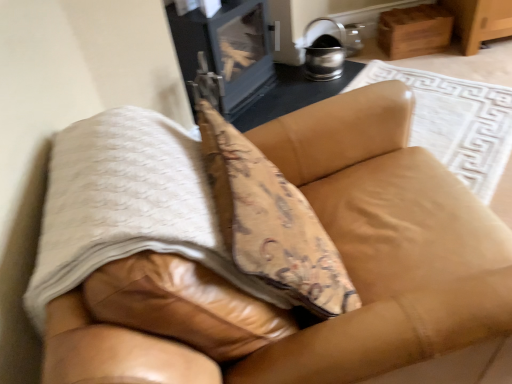
Question: Is metallic silver stove at upper center taller or shorter than leather couch at center?

Choices:
 (A) short
 (B) tall

Answer: (A)

Question: Is point (205, 23) positioned closer to the camera than point (261, 350)?

Choices:
 (A) farther
 (B) closer

Answer: (A)

Question: Which object is the closest to the metallic silver stove at upper center?

Choices:
 (A) white textured blanket at center
 (B) leather couch at center

Answer: (B)

Question: Estimate the real-world distances between objects in this image. Which object is closer to the leather couch at center?

Choices:
 (A) metallic silver stove at upper center
 (B) white textured blanket at center

Answer: (B)